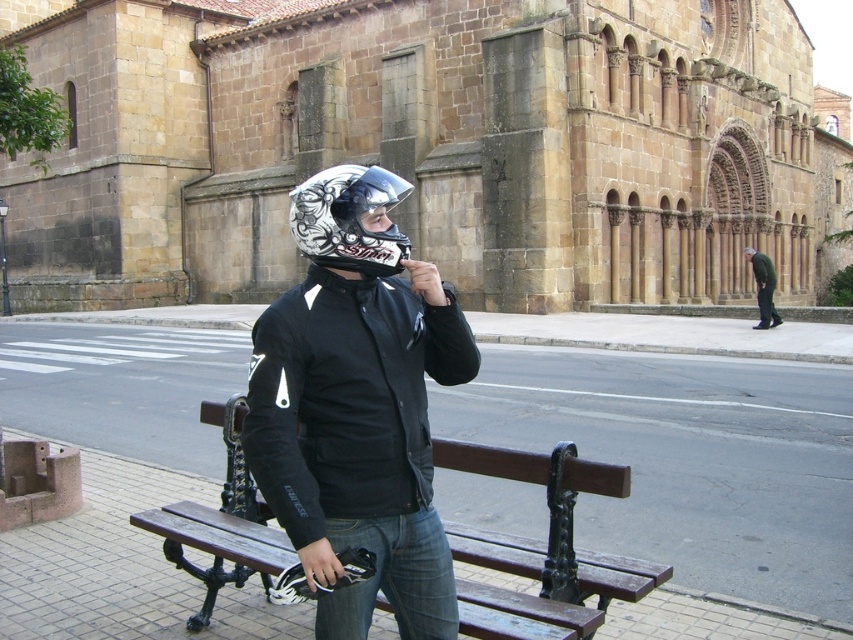
You are a photographer trying to capture a detailed shot of the historic building. You notice two points in the scene marked as point 1 at coordinates (334, 294) and point 2 at coordinates (364, 168). Which point should you focus on to ensure it appears clearer in your photo?

Point 1 at coordinates (334, 294) should be focused on because it is closer to the camera, resulting in a clearer image compared to point 2 at coordinates (364, 168) which is farther away.

You are a delivery drone trying to navigate between two points in an urban area. The first point is labeled as point (242, 554) and the second point is labeled as point (763, 257). According to the scene, which point is closer to the historic stone building?

Point (763, 257) is closer to the historic stone building because it is behind point (242, 554), which means it is nearer to the building.